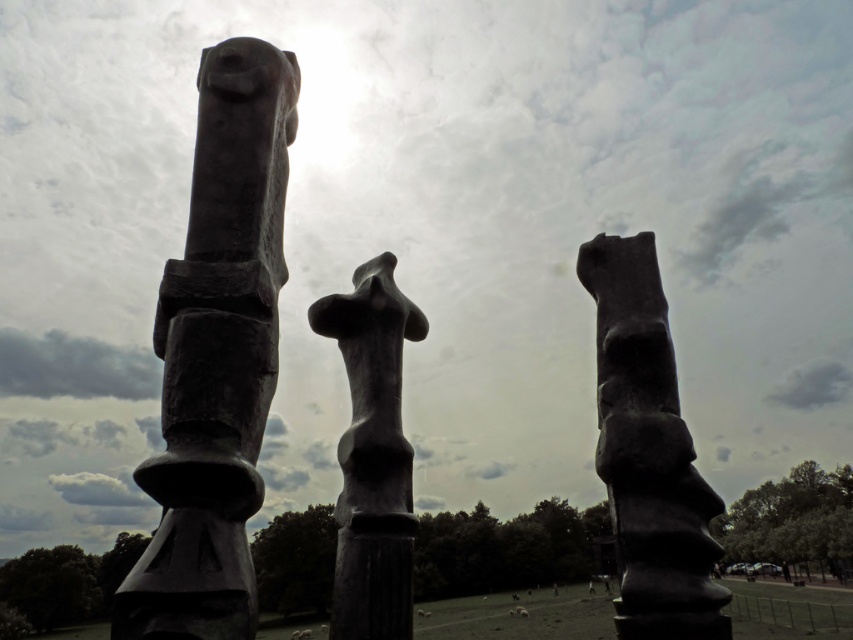
You are standing at the point marked at coordinates point (218, 355). Which object are you touching?

You are touching the matte black sculpture at left because the point (218, 355) is on that object.

You are standing at the edge of the field looking at the two sculptures. Which direction should you walk to get closer to the matte black totem pole at center without moving towards the matte black sculpture at center?

Since the matte black totem pole at center is 36.49 inches away from the matte black sculpture at center, you should walk towards the direction of the matte black totem pole at center while avoiding moving towards the matte black sculpture at center.